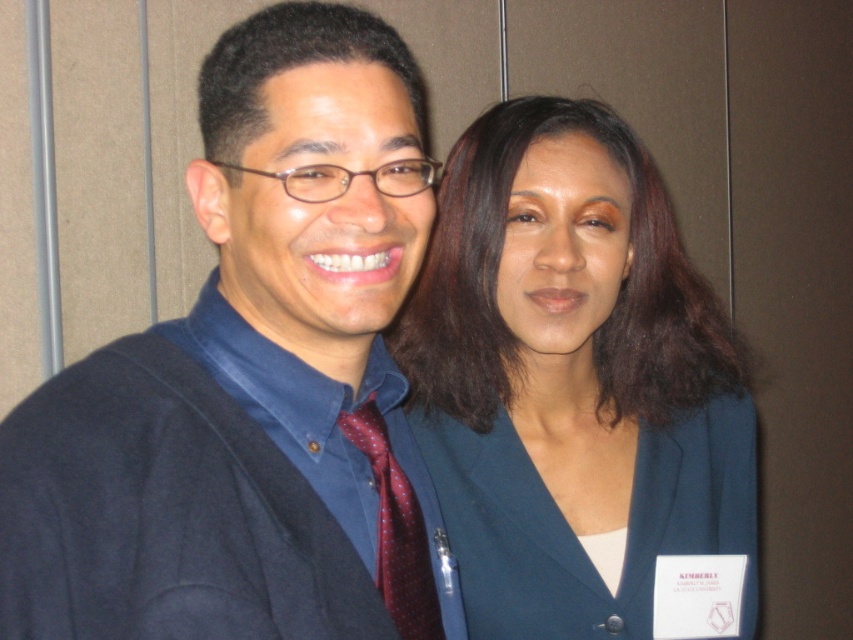
Question: Is matte black sweater at left bigger than dark blue fabric business suit at center?

Choices:
 (A) yes
 (B) no

Answer: (A)

Question: Which point is closer to the camera taking this photo?

Choices:
 (A) (404, 524)
 (B) (486, 465)

Answer: (A)

Question: Does dark blue fabric business suit at center have a smaller size compared to blue cotton dress shirt at left?

Choices:
 (A) no
 (B) yes

Answer: (A)

Question: Does blue cotton dress shirt at left come in front of maroon dotted silk tie at center?

Choices:
 (A) yes
 (B) no

Answer: (A)

Question: Which point is farther to the camera?

Choices:
 (A) dark blue fabric business suit at center
 (B) maroon dotted silk tie at center
 (C) blue cotton dress shirt at left
 (D) matte black sweater at left

Answer: (A)

Question: Which of the following is the closest to the observer?

Choices:
 (A) matte black sweater at left
 (B) dark blue fabric business suit at center
 (C) blue cotton dress shirt at left
 (D) maroon dotted silk tie at center

Answer: (A)